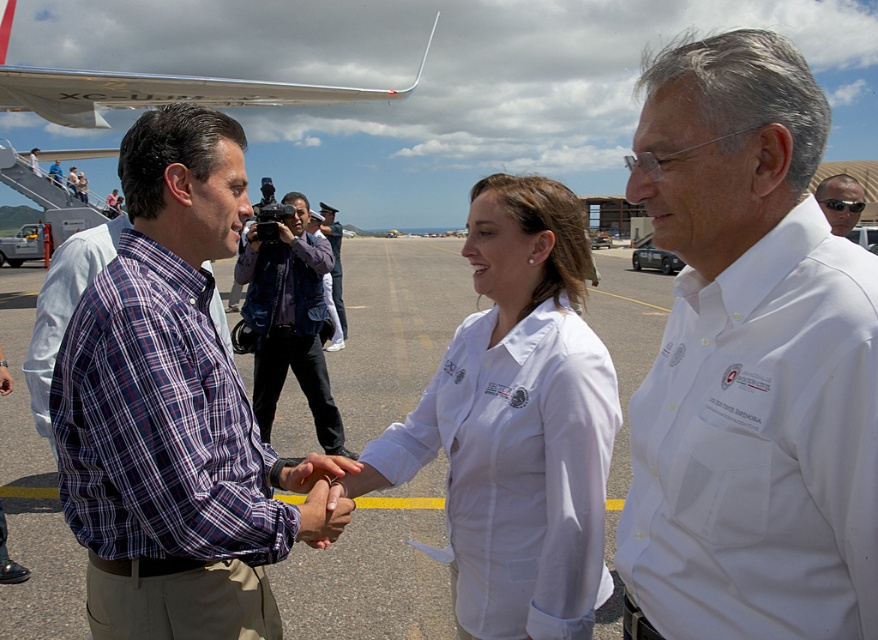
Who is higher up, white smooth shirt at center or plaid cotton shirt at center?

Positioned higher is plaid cotton shirt at center.

Which is more to the left, white smooth shirt at center or plaid cotton shirt at center?

Positioned to the left is plaid cotton shirt at center.

Who is more forward, (502,636) or (281,292)?

Point (502,636) is in front.

At what (x,y) coordinates should I click in order to perform the action: click on white smooth shirt at center. Please return your answer as a coordinate pair (x, y). Looking at the image, I should click on (516, 424).

Does smooth asphalt tarmac at center have a larger size compared to silver metallic airplane wing at upper left?

Actually, smooth asphalt tarmac at center might be smaller than silver metallic airplane wing at upper left.

Identify the location of smooth asphalt tarmac at center. This screenshot has width=878, height=640. tap(373, 570).

Which is in front, point (70, 560) or point (303, 86)?

Point (70, 560)

Locate an element on the screen. smooth asphalt tarmac at center is located at coordinates [373, 570].

Is sunglasses at center closer to the viewer compared to blue plaid shirt at center?

Yes, it is in front of blue plaid shirt at center.

Between point (848, 209) and point (333, 336), which one is positioned in front?

Positioned in front is point (848, 209).

The width and height of the screenshot is (878, 640). I want to click on sunglasses at center, so 840,202.